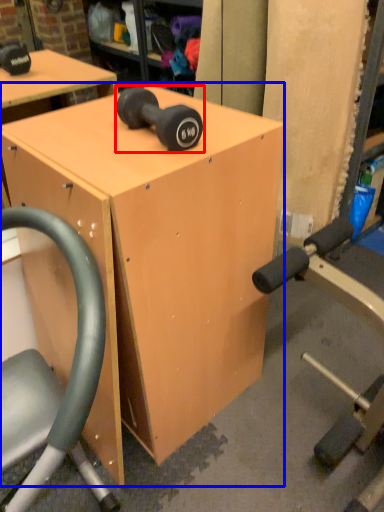
Question: Which object is further to the camera taking this photo, dumbbell (highlighted by a red box) or table (highlighted by a blue box)?

Choices:
 (A) dumbbell
 (B) table

Answer: (A)